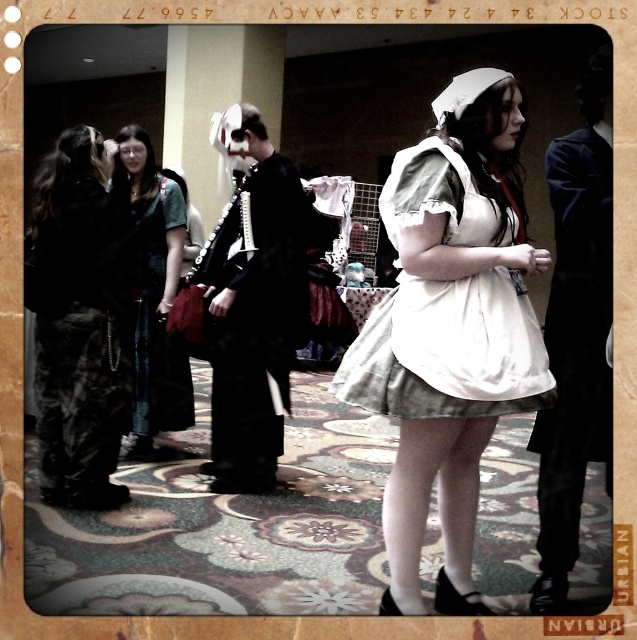
You are at an event and want to take a photo of the point at coordinates (427, 358). If you are standing 5 feet away from that point, will you be able to capture it in your shot?

The distance of point (427, 358) from viewer is 7.40 feet. Since you are standing 5 feet away from the point, you are closer than the required distance, so you can capture it in your shot.

You are at an event and see a person in a maid costume standing in the center. There is a point marked at coordinates (x=80, y=321) which is to the left of the maid costume person. What object is located at that point?

The point at (x=80, y=321) indicates camouflage pants at left.

You are a photographer at this event and want to capture a photo that includes both the person in the green dress with white apron and the camouflage pants at left. The camera you are using has a maximum focus range of 3 meters. Can you take this photo without moving the camera?

The distance between camouflage pants at left and the camera is 3.32 meters, which exceeds the camera maximum focus range of 3 meters. Therefore, you cannot take this photo without moving the camera.